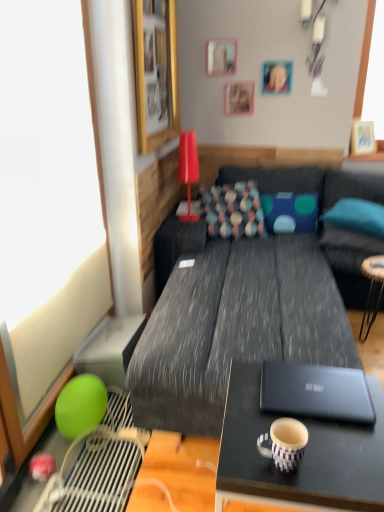
The width and height of the screenshot is (384, 512). I want to click on matte black laptop at lower right, marked as the 2th table in a right-to-left arrangement, so click(303, 456).

In order to face matte black laptop at lower right, positioned as the 1th table in front-to-back order, should I rotate leftwards or rightwards?

To face it directly, rotate right by 14.758 degrees.

What is the approximate width of porcelain textured mug at center?

porcelain textured mug at center is 5.00 inches in width.

In the scene shown: What is the approximate width of textured multicolored pillow at center, the first pillow in the left-to-right sequence?

It is 14.91 inches.

Describe the element at coordinates (233, 210) in the screenshot. This screenshot has width=384, height=512. I see `textured multicolored pillow at center, the first pillow in the left-to-right sequence` at that location.

At what (x,y) coordinates should I click in order to perform the action: click on wooden picture frame at upper right, which is the first picture frame from right to left. Please return your answer as a coordinate pair (x, y). The width and height of the screenshot is (384, 512). Looking at the image, I should click on (362, 137).

What do you see at coordinates (47, 209) in the screenshot?
I see `green matte balloon at left` at bounding box center [47, 209].

Find the location of a particular element. green matte balloon at left is located at coordinates (47, 209).

Identify the location of matte black laptop at lower right, positioned as the 1th table in front-to-back order. (303, 456).

How many degrees apart are the facing directions of teal fabric bean bag chair at right and textured multicolored pillow at center, which is the third pillow from right to left?

12.7 degrees separate the facing orientations of teal fabric bean bag chair at right and textured multicolored pillow at center, which is the third pillow from right to left.

From the image's perspective, starting from the teal fabric bean bag chair at right, which pillow is the 3rd one above? Please provide its 2D coordinates.

[(233, 210)]

In terms of width, does teal fabric bean bag chair at right look wider or thinner when compared to textured multicolored pillow at center, which is the third pillow from right to left?

Clearly, teal fabric bean bag chair at right has more width compared to textured multicolored pillow at center, which is the third pillow from right to left.

From a real-world perspective, which is physically below, teal fabric bean bag chair at right or textured multicolored pillow at center, which is the third pillow from right to left?

From a 3D spatial view, teal fabric bean bag chair at right is below.

Measure the distance between matte red table lamp at upper center and porcelain textured mug at center.

matte red table lamp at upper center is 6.53 feet away from porcelain textured mug at center.

Which is closer, [179,175] or [273,438]?

Clearly, point [179,175] is more distant from the camera than point [273,438].

Can you confirm if matte red table lamp at upper center is bigger than porcelain textured mug at center?

Yes, matte red table lamp at upper center is bigger than porcelain textured mug at center.

Which is correct: matte red table lamp at upper center is inside porcelain textured mug at center, or outside of it?

matte red table lamp at upper center lies outside porcelain textured mug at center.

Would you consider wooden picture frame at upper right, placed as the 2th picture frame when sorted from back to front, to be distant from black matte table at right, the 1th table when ordered from back to front?

Yes, wooden picture frame at upper right, placed as the 2th picture frame when sorted from back to front, and black matte table at right, the 1th table when ordered from back to front, are located far from each other.

From a real-world perspective, is wooden picture frame at upper right, which is the fifth picture frame in left-to-right order, physically located above or below black matte table at right, positioned as the first table in top-to-bottom order?

wooden picture frame at upper right, which is the fifth picture frame in left-to-right order, is above black matte table at right, positioned as the first table in top-to-bottom order.

What are the coordinates of `picture frame on the right of black matte table at right, which is the 2th table from left to right` in the screenshot? It's located at (362, 137).

Can you confirm if wooden picture frame at upper right, which is the fifth picture frame in left-to-right order, is wider than black matte table at right, positioned as the first table in top-to-bottom order?

No.

Is wooden picture frame at upper center, which appears as the second picture frame when viewed from the front, spatially inside teal rubber ball at lower left, or outside of it?

wooden picture frame at upper center, which appears as the second picture frame when viewed from the front, is spatially situated outside teal rubber ball at lower left.

Is wooden picture frame at upper center, which appears as the second picture frame when viewed from the front, aimed at teal rubber ball at lower left?

No, wooden picture frame at upper center, which appears as the second picture frame when viewed from the front, does not turn towards teal rubber ball at lower left.

Does wooden picture frame at upper center, which appears as the second picture frame when viewed from the right, lie behind teal rubber ball at lower left?

That is True.

The width and height of the screenshot is (384, 512). Identify the location of the 1st pillow below the wooden picture frame at upper center, the 4th picture frame when ordered from back to front (from the image's perspective). (233, 210).

Does wooden picture frame at upper center, which appears as the second picture frame when viewed from the right, contain textured multicolored pillow at center, the first pillow in the left-to-right sequence?

Definitely not — textured multicolored pillow at center, the first pillow in the left-to-right sequence, is not inside wooden picture frame at upper center, which appears as the second picture frame when viewed from the right.

Is point (265, 86) positioned in front of point (210, 224)?

No.

Is wooden picture frame at upper center, the 4th picture frame when ordered from back to front, facing away from textured multicolored pillow at center, which is the third pillow from right to left?

No, wooden picture frame at upper center, the 4th picture frame when ordered from back to front, is not facing the opposite direction of textured multicolored pillow at center, which is the third pillow from right to left.

Does green matte balloon at left turn towards teal rubber ball at lower left?

Yes.

How many degrees apart are the facing directions of green matte balloon at left and teal rubber ball at lower left?

1.14 degrees.

Can you confirm if green matte balloon at left is wider than teal rubber ball at lower left?

Incorrect, the width of green matte balloon at left does not surpass that of teal rubber ball at lower left.

From a real-world perspective, between green matte balloon at left and teal rubber ball at lower left, who is vertically lower?

From a 3D spatial view, teal rubber ball at lower left is below.

Does point (296, 222) lie behind point (247, 220)?

Yes, point (296, 222) is farther from viewer.

Does blue dotted pillow at center, the 2th pillow when ordered from right to left, touch textured multicolored pillow at center, the first pillow in the left-to-right sequence?

blue dotted pillow at center, the 2th pillow when ordered from right to left, and textured multicolored pillow at center, the first pillow in the left-to-right sequence, are clearly separated.

From a real-world perspective, who is located lower, blue dotted pillow at center, the 2th pillow when ordered from right to left, or textured multicolored pillow at center, which is the third pillow from right to left?

In real-world perspective, blue dotted pillow at center, the 2th pillow when ordered from right to left, is lower.

Does blue dotted pillow at center, the 2th pillow when ordered from right to left, come in front of textured multicolored pillow at center, which is the third pillow from right to left?

No.

This screenshot has height=512, width=384. Identify the location of pillow that is the 2nd one above the teal fabric bean bag chair at right (from a real-world perspective). (233, 210).

The image size is (384, 512). Identify the location of coffee cup in front of the matte red table lamp at upper center. (284, 443).

Estimate the real-world distances between objects in this image. Which object is further from black matte laptop at center, wooden picture frame at upper center, the 1th picture frame positioned from the back, or metallic silver picture frame at upper center, the third picture frame from the front?

Based on the image, metallic silver picture frame at upper center, the third picture frame from the front, appears to be further to black matte laptop at center.

Estimate the real-world distances between objects in this image. Which object is further from textured gray couch at center, matte black laptop at lower right, marked as the 2th table in a right-to-left arrangement, or wooden picture frame at upper center, the 4th picture frame when ordered from back to front?

Among the two, wooden picture frame at upper center, the 4th picture frame when ordered from back to front, is located further to textured gray couch at center.

Based on their spatial positions, is blue dotted pillow at right, marked as the 1th pillow in a right-to-left arrangement, or textured gray couch at center closer to porcelain textured mug at center?

Based on the image, textured gray couch at center appears to be nearer to porcelain textured mug at center.

Looking at this image, from the image, which object appears to be farther from green matte balloon at left, textured gray couch at center or textured multicolored pillow at center, the first pillow in the left-to-right sequence?

Based on the image, textured multicolored pillow at center, the first pillow in the left-to-right sequence, appears to be further to green matte balloon at left.

From the image, which object appears to be nearer to teal rubber ball at lower left, wooden picture frame at upper center, the 1th picture frame positioned from the back, or matte red table lamp at upper center?

matte red table lamp at upper center is closer to teal rubber ball at lower left.

From the image, which object appears to be farther from blue dotted pillow at center, which is the 2th pillow in left-to-right order, black matte table at right, which appears as the second table when viewed from the front, or teal rubber ball at lower left?

The object further to blue dotted pillow at center, which is the 2th pillow in left-to-right order, is teal rubber ball at lower left.

When comparing their distances from metallic silver picture frame at upper center, which is the third picture frame in back-to-front order, does black matte table at right, which appears as the second table when viewed from the front, or matte black laptop at lower right, which is counted as the second table, starting from the top, seem further?

matte black laptop at lower right, which is counted as the second table, starting from the top, is further to metallic silver picture frame at upper center, which is the third picture frame in back-to-front order.

Based on their spatial positions, is wooden picture frame at upper center, which appears as the second picture frame when viewed from the right, or matte black laptop at lower right, which ranks as the first table in left-to-right order, further from textured gray couch at center?

wooden picture frame at upper center, which appears as the second picture frame when viewed from the right, is positioned further to the anchor textured gray couch at center.

Locate an element on the screen. The image size is (384, 512). laptop between matte black laptop at lower right, which is counted as the second table, starting from the top, and textured multicolored pillow at center, which is the third pillow from right to left, along the z-axis is located at coordinates (316, 393).

You are a GUI agent. You are given a task and a screenshot of the screen. Output one action in this format:
    pyautogui.click(x=<x>, y=<y>)
    Task: Click on the coffee cup located between matte black laptop at lower right, which is counted as the second table, starting from the top, and matte red table lamp at upper center in the depth direction
    The image size is (384, 512).
    Given the screenshot: What is the action you would take?
    pyautogui.click(x=284, y=443)

The image size is (384, 512). What are the coordinates of `table between wooden picture frame at upper left, the 1th picture frame from the left, and teal rubber ball at lower left, in the vertical direction` in the screenshot? It's located at (372, 289).

Identify the location of bean bag chair between black matte laptop at center and matte red table lamp at upper center along the z-axis. (349, 261).